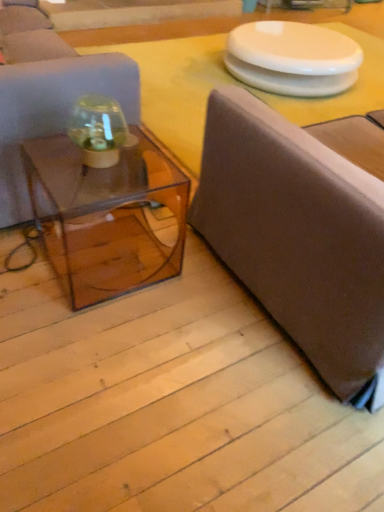
Question: From the image's perspective, is transparent glass table at center beneath transparent glass jar at center?

Choices:
 (A) yes
 (B) no

Answer: (B)

Question: Is transparent glass table at center at the right side of transparent glass jar at center?

Choices:
 (A) no
 (B) yes

Answer: (B)

Question: Is transparent glass table at center turned away from transparent glass jar at center?

Choices:
 (A) yes
 (B) no

Answer: (B)

Question: Is transparent glass table at center to the left of transparent glass jar at center from the viewer's perspective?

Choices:
 (A) no
 (B) yes

Answer: (A)

Question: Is transparent glass table at center wider than transparent glass jar at center?

Choices:
 (A) no
 (B) yes

Answer: (B)

Question: Is transparent glass table at center taller than transparent glass jar at center?

Choices:
 (A) no
 (B) yes

Answer: (A)

Question: Is transparent acrylic coffee table at center to the left of matte gray studio couch at right, the 1th studio couch positioned from the right, from the viewer's perspective?

Choices:
 (A) no
 (B) yes

Answer: (B)

Question: From the image's perspective, does transparent acrylic coffee table at center appear lower than matte gray studio couch at right, the 1th studio couch positioned from the right?

Choices:
 (A) yes
 (B) no

Answer: (A)

Question: From the image's perspective, would you say transparent acrylic coffee table at center is positioned over matte gray studio couch at right, the 1th studio couch positioned from the right?

Choices:
 (A) yes
 (B) no

Answer: (B)

Question: Is the position of transparent acrylic coffee table at center more distant than that of matte gray studio couch at right, the 1th studio couch positioned from the right?

Choices:
 (A) no
 (B) yes

Answer: (B)

Question: Can matte gray studio couch at right, the 1th studio couch positioned from the right, be found inside transparent acrylic coffee table at center?

Choices:
 (A) no
 (B) yes

Answer: (A)

Question: Is transparent acrylic coffee table at center completely or partially outside of matte gray studio couch at right, which appears as the 2th studio couch when viewed from the left?

Choices:
 (A) no
 (B) yes

Answer: (B)

Question: Is matte brown couch at left, marked as the 1th studio couch in a left-to-right arrangement, positioned behind transparent acrylic coffee table at center?

Choices:
 (A) yes
 (B) no

Answer: (A)